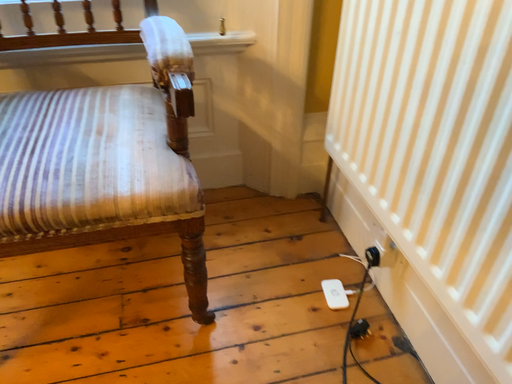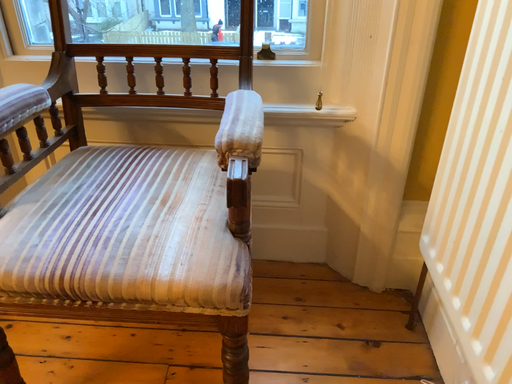
Question: Which way did the camera rotate in the video?

Choices:
 (A) rotated upward
 (B) rotated downward

Answer: (A)